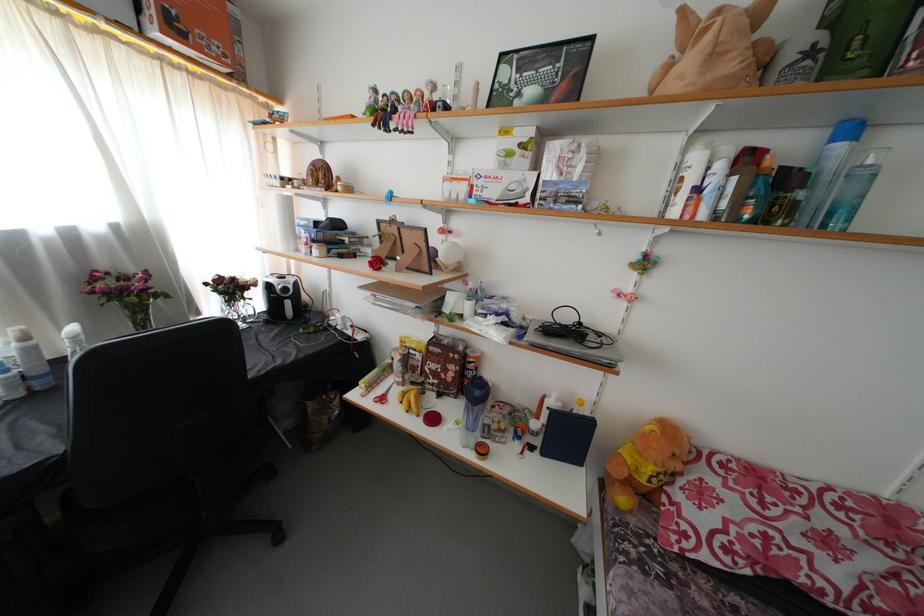
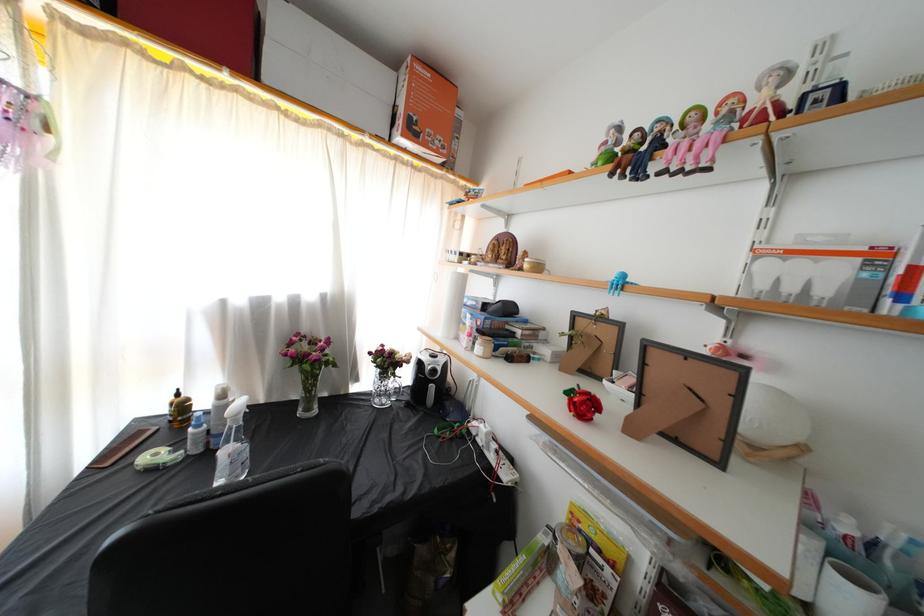
In the second image, find the point that corresponds to point (296, 286) in the first image.

(446, 365)